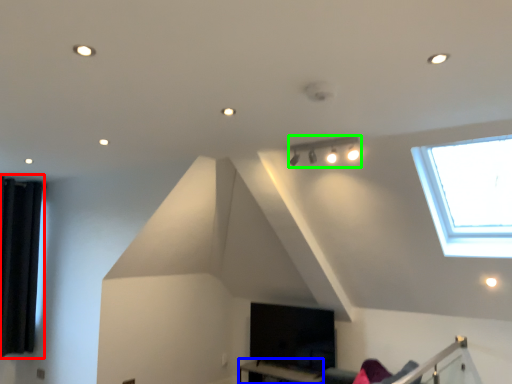
Question: Which object is positioned closest to curtain (highlighted by a red box)? Select from table (highlighted by a blue box) and lamp (highlighted by a green box).

Choices:
 (A) table
 (B) lamp

Answer: (A)